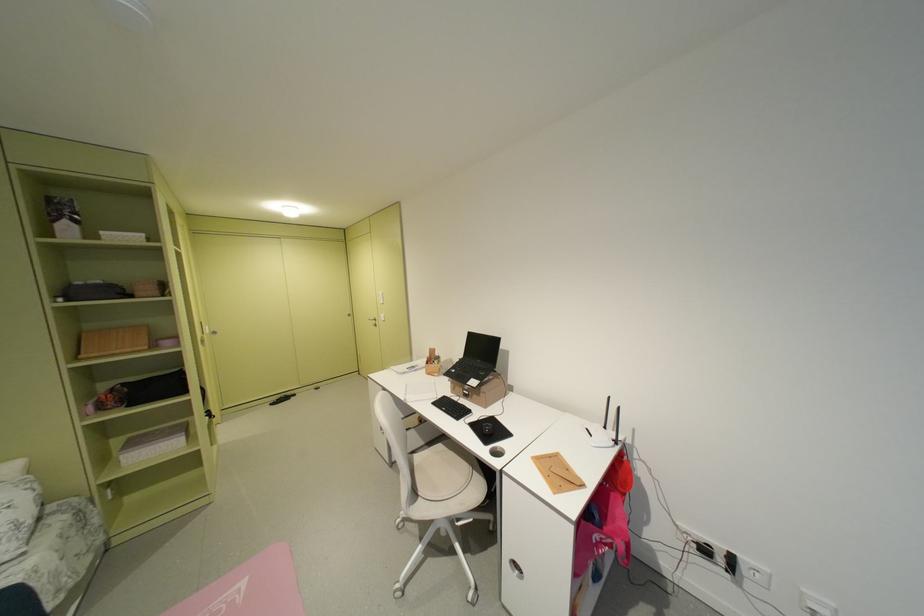
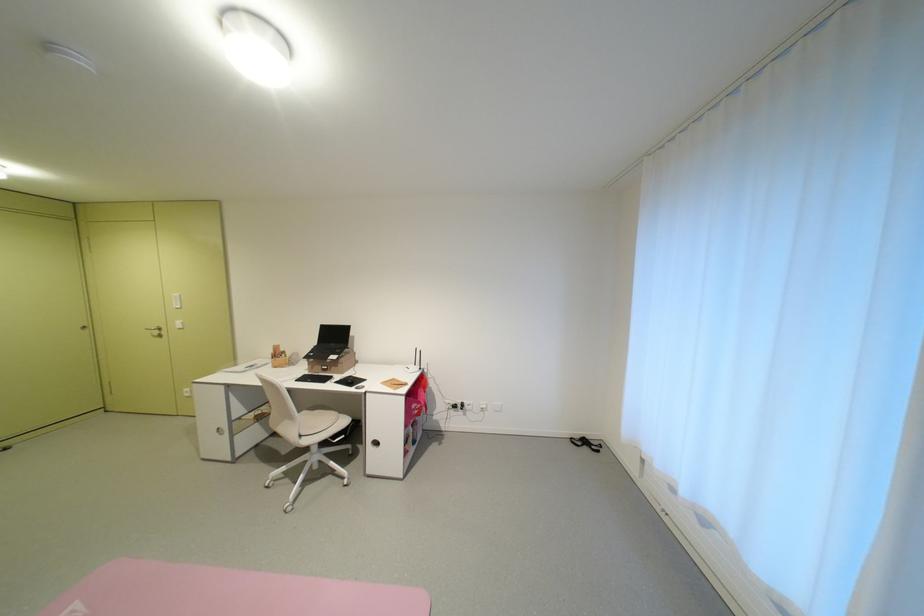
Locate, in the second image, the point that corresponds to point 429,495 in the first image.

(311, 436)